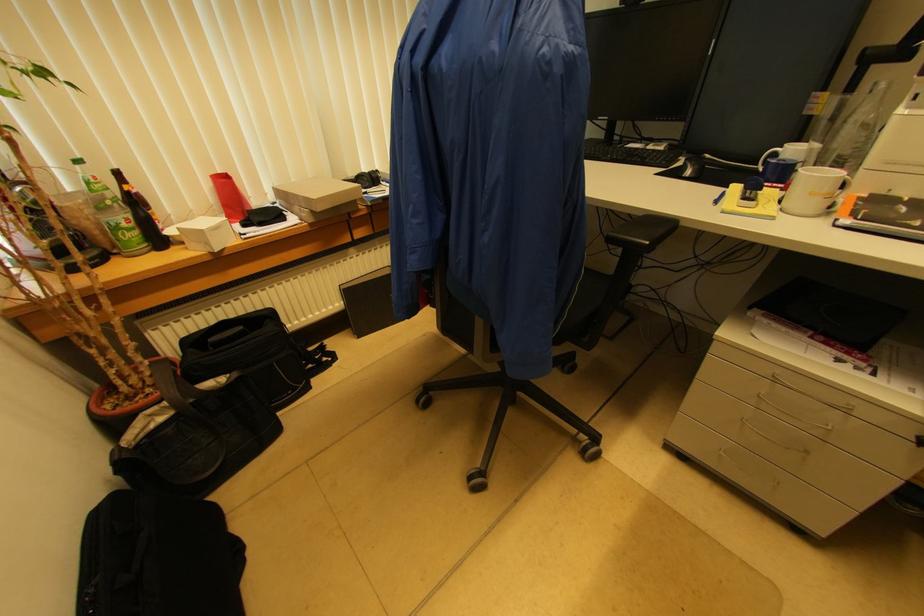
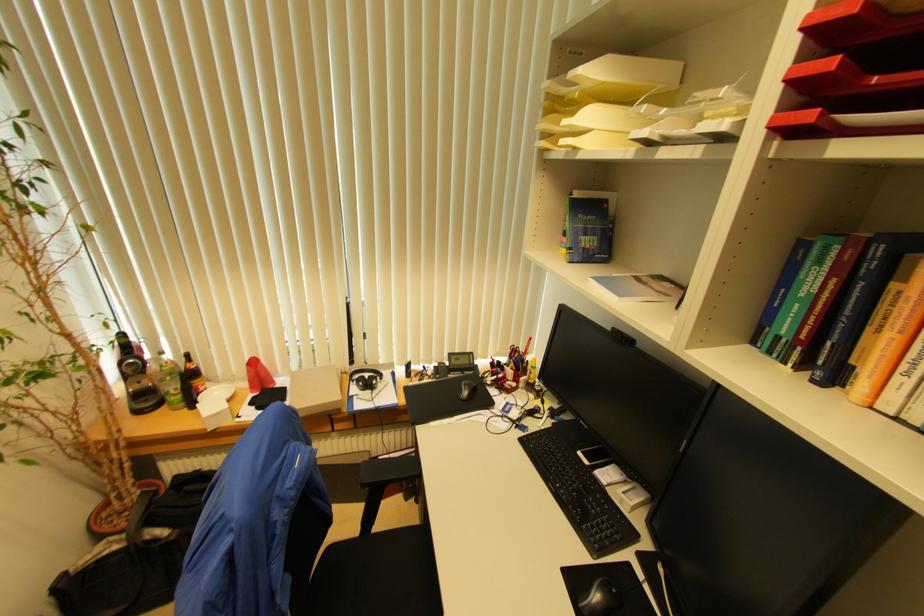
Find the pixel in the second image that matches (118,176) in the first image.

(188, 358)